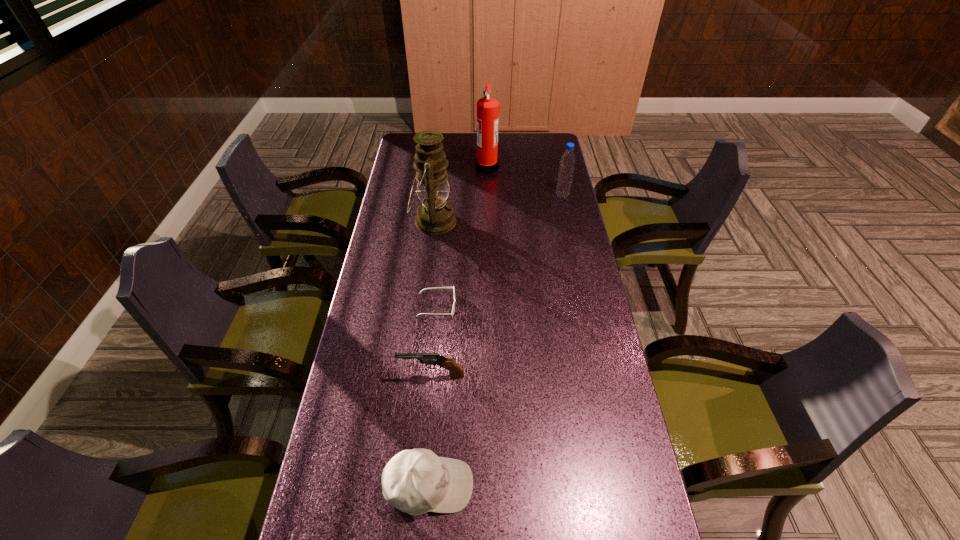
Where is `free space that satisfies the following two spatial constraints: 1. with the nozzle aimed from the second farthest object; 2. on the right side of the fire extinguisher`? This screenshot has width=960, height=540. free space that satisfies the following two spatial constraints: 1. with the nozzle aimed from the second farthest object; 2. on the right side of the fire extinguisher is located at coordinates (488, 195).